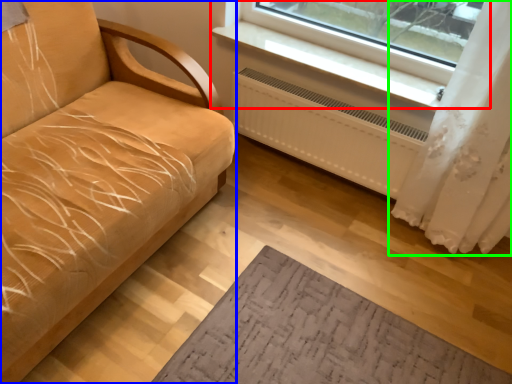
Question: Based on their relative distances, which object is nearer to window (highlighted by a red box)? Choose from studio couch (highlighted by a blue box) and curtain (highlighted by a green box).

Choices:
 (A) studio couch
 (B) curtain

Answer: (B)